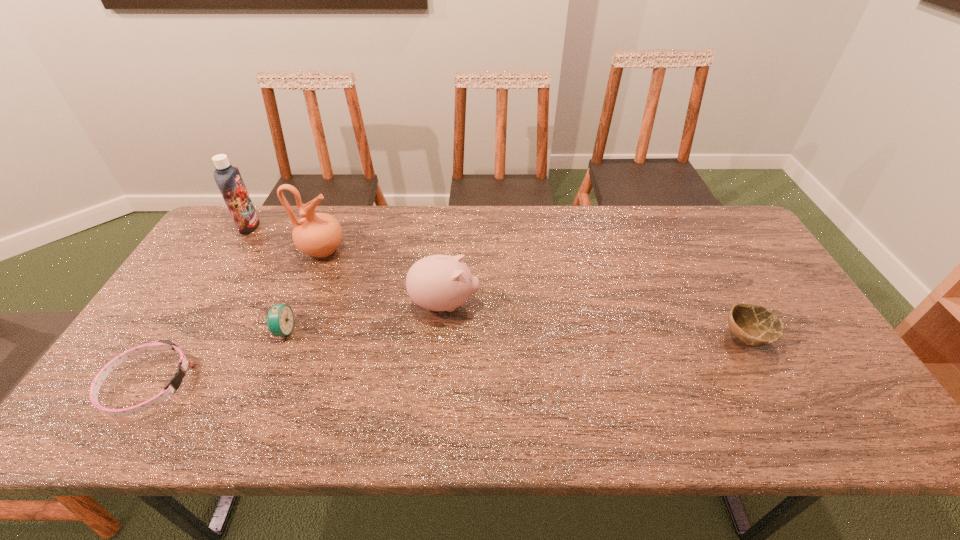
I want to click on object at the far left corner, so click(x=228, y=178).

What are the coordinates of `object at the near left corner` in the screenshot? It's located at click(x=176, y=380).

Locate an element on the screen. The width and height of the screenshot is (960, 540). vacant space at the far edge of the desktop is located at coordinates (429, 207).

You are a GUI agent. You are given a task and a screenshot of the screen. Output one action in this format:
    pyautogui.click(x=<x>, y=<y>)
    Task: Click on the free space at the near edge of the desktop
    This screenshot has width=960, height=540.
    Given the screenshot: What is the action you would take?
    tap(313, 410)

In order to click on vacant space at the right edge of the desktop in this screenshot , I will do `click(804, 323)`.

Locate an element on the screen. vacant region at the far right corner of the desktop is located at coordinates (744, 247).

Where is `empty space between the alarm clock and the shortest object`? This screenshot has height=540, width=960. empty space between the alarm clock and the shortest object is located at coordinates (216, 357).

The width and height of the screenshot is (960, 540). What are the coordinates of `free spot between the shampoo and the third tallest object` in the screenshot? It's located at (347, 265).

At what (x,y) coordinates should I click in order to perform the action: click on vacant area between the pottery and the shampoo. Please return your answer as a coordinate pair (x, y). The height and width of the screenshot is (540, 960). Looking at the image, I should click on [x=286, y=238].

Identify the location of free point between the shampoo and the dog collar. (199, 305).